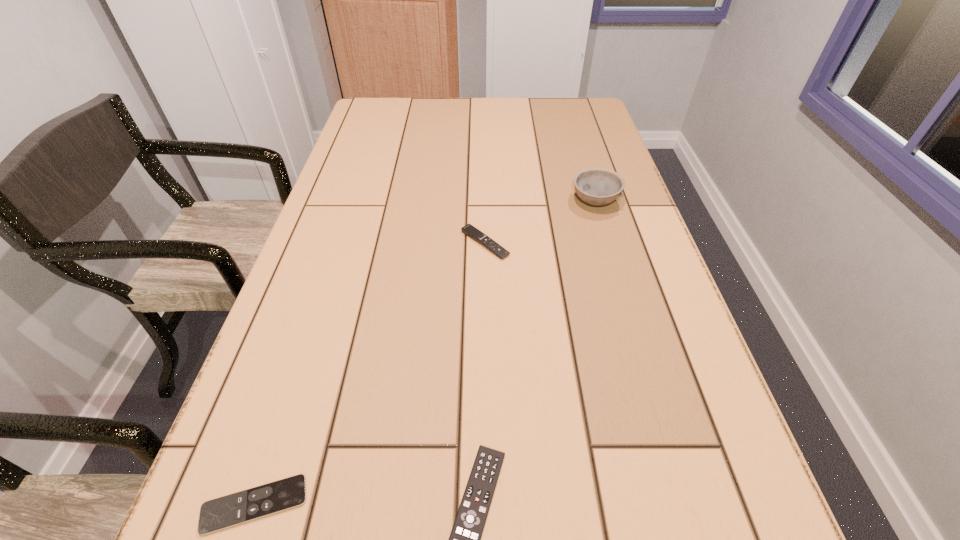
At what (x,y) coordinates should I click in order to perform the action: click on object present at the right edge. Please return your answer as a coordinate pair (x, y). This screenshot has width=960, height=540. Looking at the image, I should click on (596, 186).

In the image, there is a desktop. Where is `vacant space at the far edge`? The image size is (960, 540). vacant space at the far edge is located at coordinates (447, 131).

Find the location of a particular element. Image resolution: width=960 pixels, height=540 pixels. free spot at the left edge of the desktop is located at coordinates (302, 506).

Where is `vacant space at the right edge of the desktop`? vacant space at the right edge of the desktop is located at coordinates (564, 140).

At what (x,y) coordinates should I click in order to perform the action: click on free space at the far right corner of the desktop. Please return your answer as a coordinate pair (x, y). The image size is (960, 540). Looking at the image, I should click on (571, 100).

Where is `vacant region between the third nearest object and the shortest remote control`? This screenshot has height=540, width=960. vacant region between the third nearest object and the shortest remote control is located at coordinates (370, 374).

Identify the location of empty space that is in between the rightmost object and the leftmost remote control. (424, 353).

Where is `free space between the tallest remote control and the farthest object`? free space between the tallest remote control and the farthest object is located at coordinates (540, 222).

Locate an element on the screen. The image size is (960, 540). free space that is in between the rightmost object and the leftmost object is located at coordinates [x=424, y=353].

Where is `object that is the second closest to the bowl`? The width and height of the screenshot is (960, 540). object that is the second closest to the bowl is located at coordinates (465, 538).